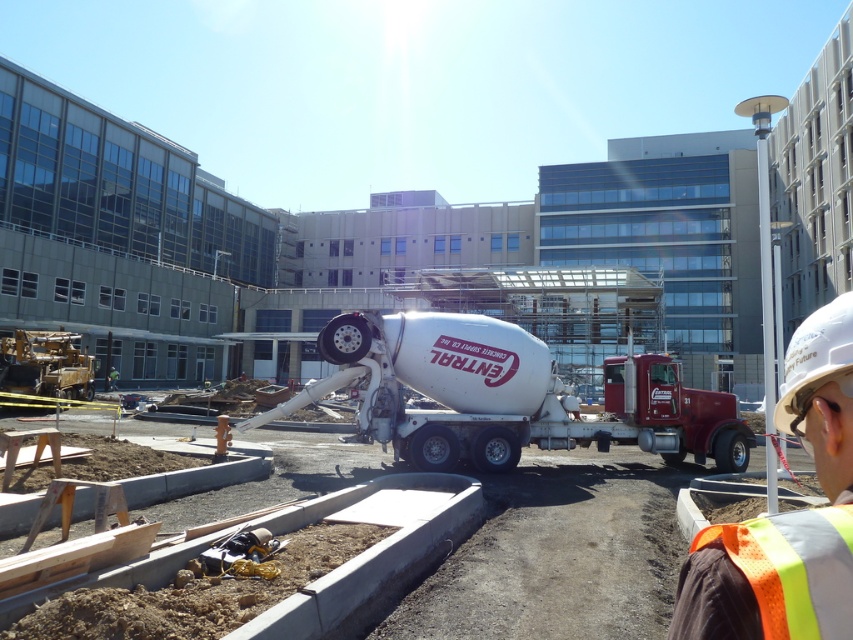
You are a construction worker who needs to place a white hard hat at upper right onto a white metallic concrete mixer at center. Can you reach the hard hat from the mixer without moving more than 10 meters?

The white metallic concrete mixer at center and white hard hat at upper right are 9.11 meters apart, so yes, you can reach the hard hat from the mixer without moving more than 10 meters.